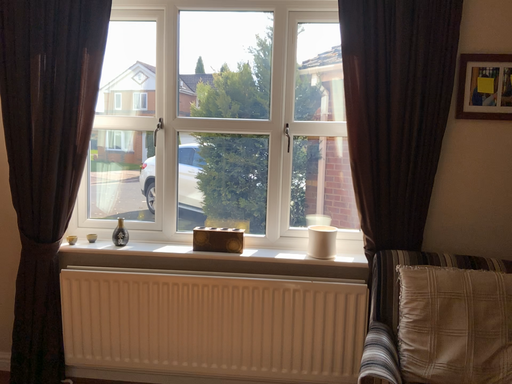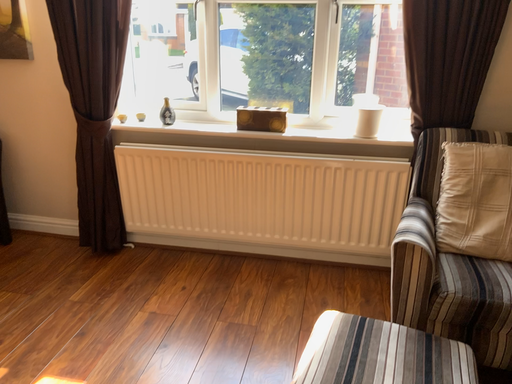
Question: Which way did the camera rotate in the video?

Choices:
 (A) rotated upward
 (B) rotated downward

Answer: (B)